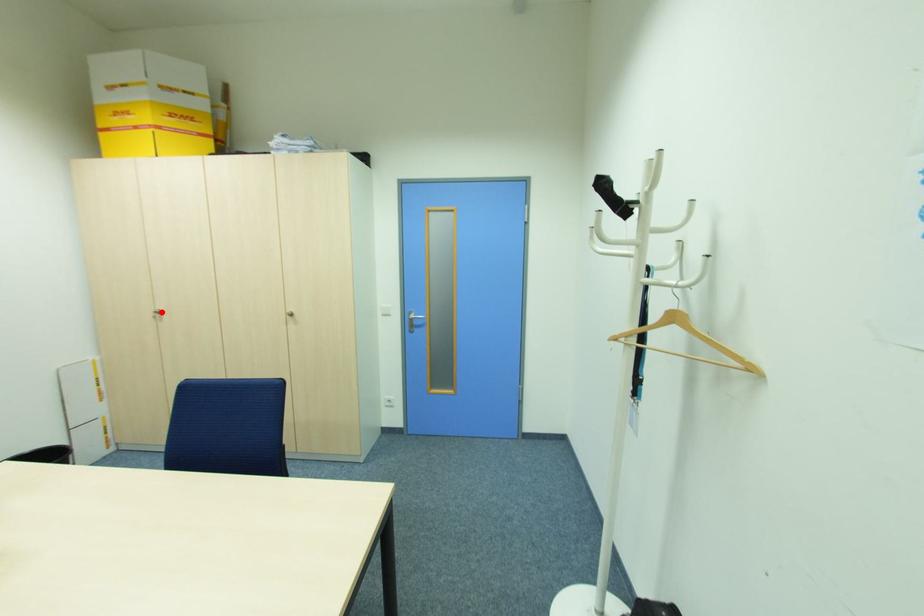
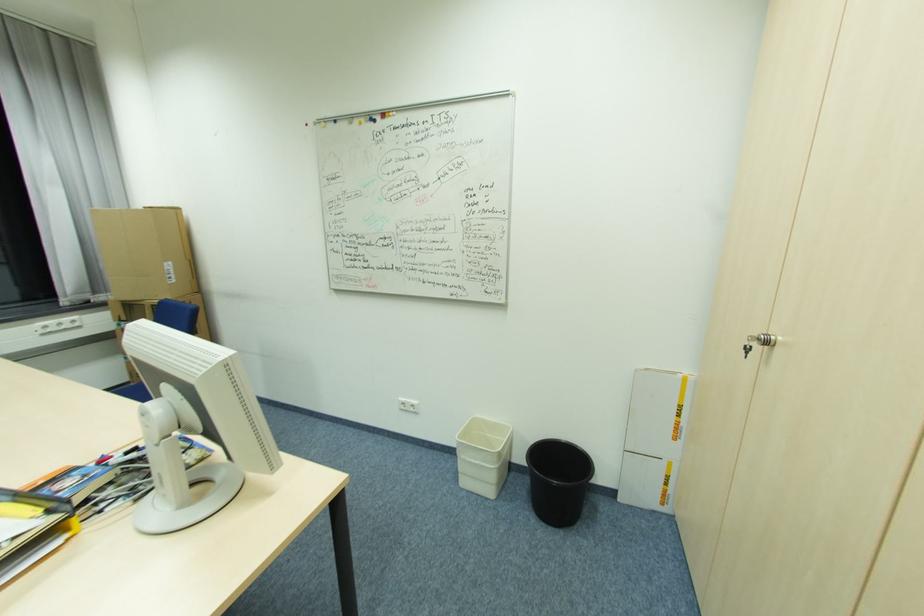
Find the pixel in the second image that matches the highlighted location in the first image.

(772, 344)